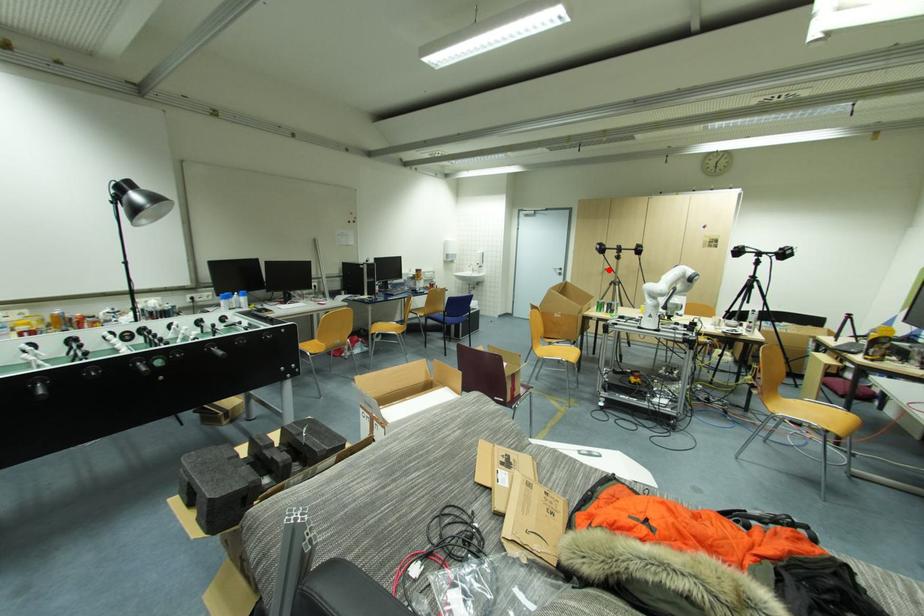
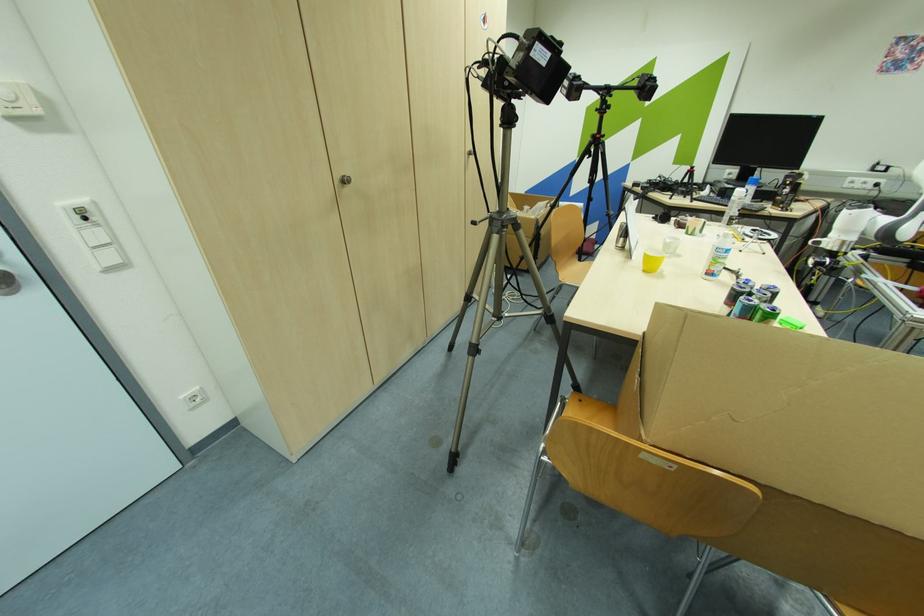
In the second image, find the point that corresponds to the highlighted location in the first image.

(348, 182)